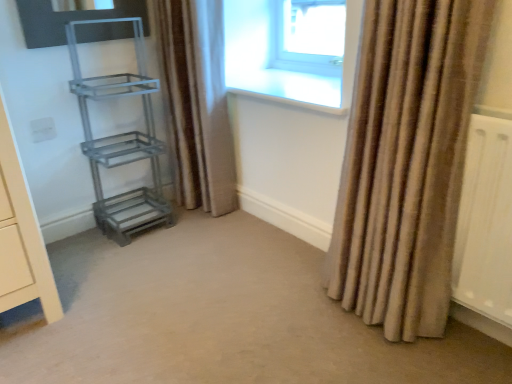
Where is `vacant space to the left of beige textured curtain at right, which appears as the second curtain when viewed from the back`? This screenshot has width=512, height=384. vacant space to the left of beige textured curtain at right, which appears as the second curtain when viewed from the back is located at coordinates (276, 314).